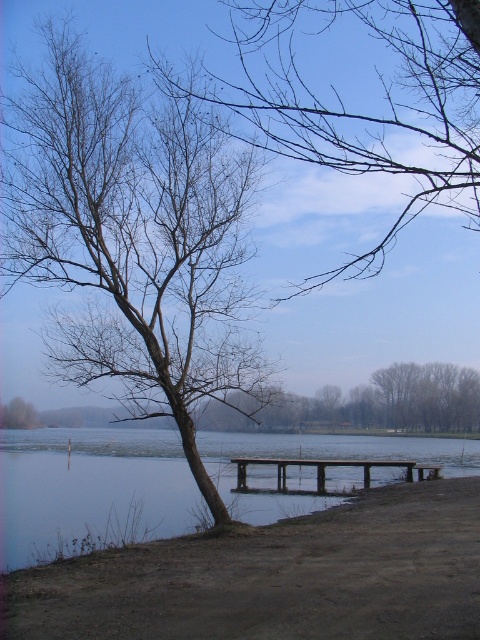
Is bare branches at upper center below transparent water at lower left?

No.

Does bare branches at upper center appear on the left side of transparent water at lower left?

Incorrect, bare branches at upper center is not on the left side of transparent water at lower left.

Which is in front, point (322, 108) or point (339, 444)?

Point (322, 108) is in front.

I want to click on bare branches at upper center, so click(x=364, y=113).

Is the position of bare branches at upper center less distant than that of brown wooden dock at center?

Yes, bare branches at upper center is closer to the viewer.

How far apart are bare branches at upper center and brown wooden dock at center?

A distance of 9.55 meters exists between bare branches at upper center and brown wooden dock at center.

Does point (300, 84) come farther from viewer compared to point (345, 465)?

No.

Image resolution: width=480 pixels, height=640 pixels. What are the coordinates of `bare branches at upper center` in the screenshot? It's located at (364, 113).

Can you confirm if brown wooden dock at center is shorter than bare wood tree at left?

Yes, brown wooden dock at center is shorter than bare wood tree at left.

Between point (324, 490) and point (9, 417), which one is positioned behind?

The point (324, 490) is behind.

This screenshot has width=480, height=640. Identify the location of brown wooden dock at center. (324, 468).